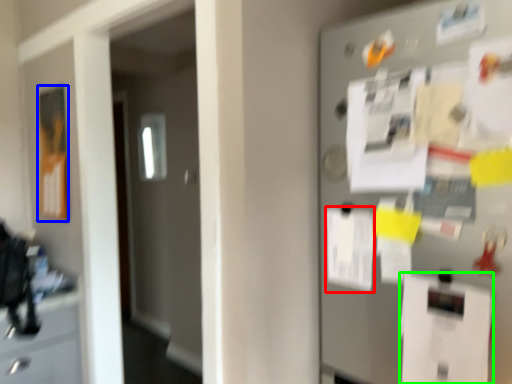
Question: Which object is positioned closest to paper (highlighted by a red box)? Select from poster (highlighted by a blue box) and paper (highlighted by a green box).

Choices:
 (A) poster
 (B) paper

Answer: (B)